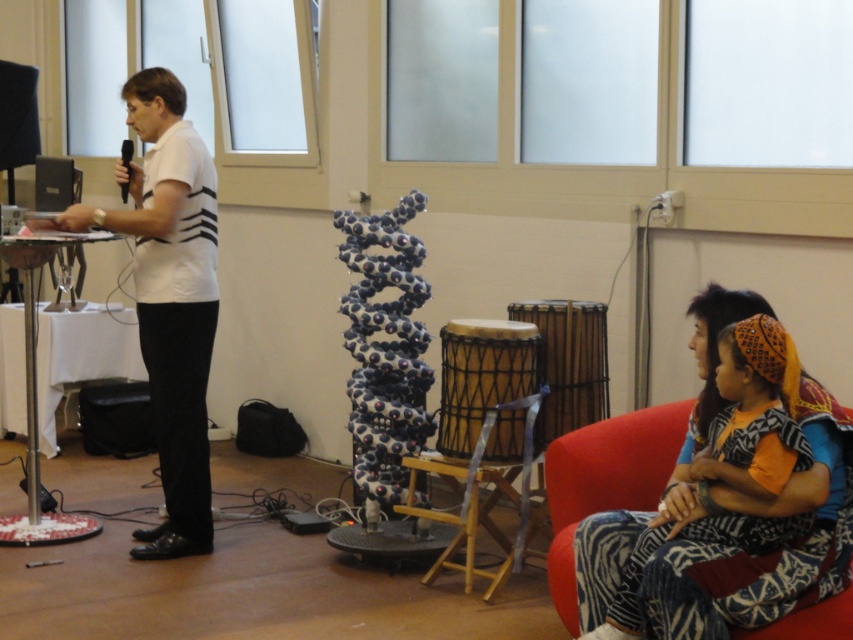
You are attending an event and need to sit down. There is a velvet fabric armchair at lower right and a black plastic microphone at upper left. Which object is taller and would be more suitable for sitting?

The velvet fabric armchair at lower right is much taller than the black plastic microphone at upper left, so it would be more suitable for sitting.

You are organizing a small event and need to seat a guest in the velvet fabric armchair at lower right. The guest is wearing a white matte shirt at center that is wider than the chair. Will the guest be able to sit comfortably without the shirt getting caught on the chair?

The white matte shirt at center is wider than the velvet fabric armchair at lower right, so the guest may have difficulty sitting comfortably as the shirt might get caught on the chair.

You are organizing a presentation and need to ensure that the white matte shirt at center and the black plastic microphone at upper left are visible to the audience. Based on their sizes, which object might require more space in the presentation layout?

The white matte shirt at center might require more space in the presentation layout since it is wider than the black plastic microphone at upper left according to the description.